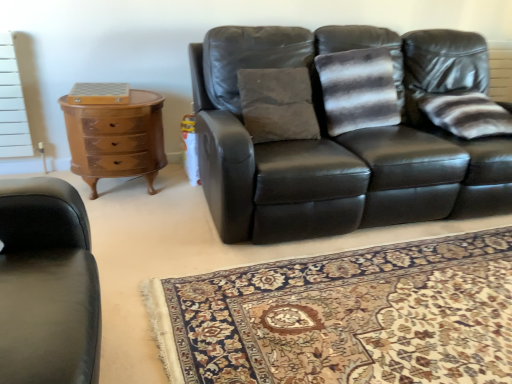
Question: From a real-world perspective, is striped fabric pillow at right below carpet with intricate floral pattern at center?

Choices:
 (A) no
 (B) yes

Answer: (A)

Question: Does striped fabric pillow at right touch carpet with intricate floral pattern at center?

Choices:
 (A) yes
 (B) no

Answer: (B)

Question: Is striped fabric pillow at right smaller than carpet with intricate floral pattern at center?

Choices:
 (A) yes
 (B) no

Answer: (A)

Question: From a real-world perspective, does striped fabric pillow at right stand above carpet with intricate floral pattern at center?

Choices:
 (A) yes
 (B) no

Answer: (A)

Question: Can you confirm if striped fabric pillow at right is positioned to the right of carpet with intricate floral pattern at center?

Choices:
 (A) no
 (B) yes

Answer: (B)

Question: Is striped fabric pillow at right wider than carpet with intricate floral pattern at center?

Choices:
 (A) yes
 (B) no

Answer: (B)

Question: Is striped fabric pillow at right oriented towards matte black leather couch at center?

Choices:
 (A) no
 (B) yes

Answer: (B)

Question: Is matte black leather couch at center a part of striped fabric pillow at right?

Choices:
 (A) yes
 (B) no

Answer: (B)

Question: Considering the relative positions of striped fabric pillow at right and matte black leather couch at center in the image provided, is striped fabric pillow at right in front of matte black leather couch at center?

Choices:
 (A) no
 (B) yes

Answer: (A)

Question: Considering the relative sizes of striped fabric pillow at right and matte black leather couch at center in the image provided, is striped fabric pillow at right wider than matte black leather couch at center?

Choices:
 (A) yes
 (B) no

Answer: (B)

Question: From the image's perspective, is striped fabric pillow at right beneath matte black leather couch at center?

Choices:
 (A) no
 (B) yes

Answer: (A)

Question: Is striped fabric pillow at right positioned with its back to matte black leather couch at center?

Choices:
 (A) yes
 (B) no

Answer: (A)

Question: Is carpet with intricate floral pattern at center with striped fabric pillow at right?

Choices:
 (A) yes
 (B) no

Answer: (B)